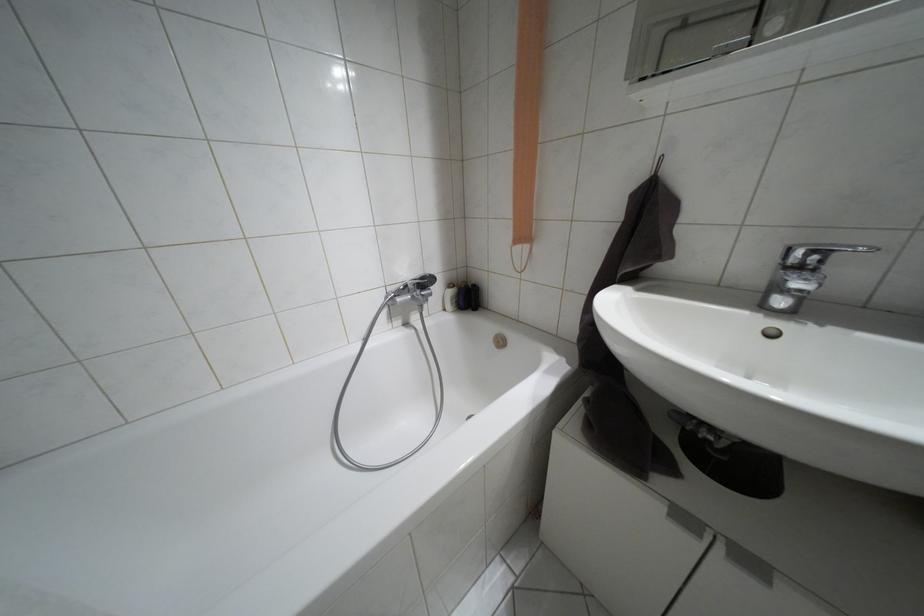
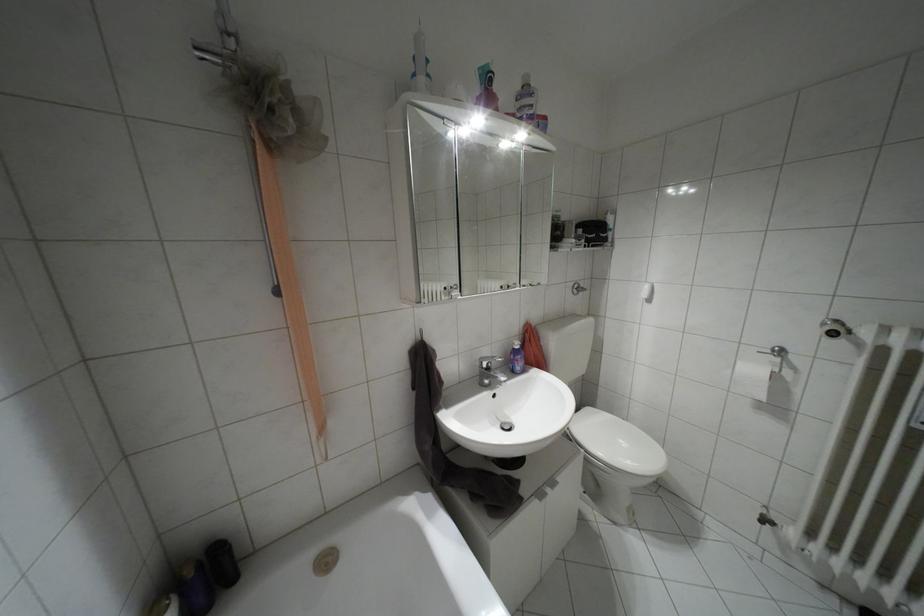
Question: The camera is either moving clockwise (left) or counter-clockwise (right) around the object. The first image is from the beginning of the video and the second image is from the end. Is the camera moving left or right when shooting the video?

Choices:
 (A) Left
 (B) Right

Answer: (A)